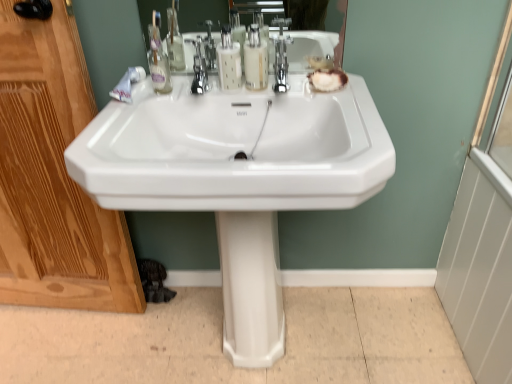
Image resolution: width=512 pixels, height=384 pixels. What do you see at coordinates (229, 61) in the screenshot? I see `translucent plastic soap dispenser at center, marked as the first soap dispenser in a left-to-right arrangement` at bounding box center [229, 61].

The height and width of the screenshot is (384, 512). Describe the element at coordinates (281, 55) in the screenshot. I see `polished chrome faucet at center` at that location.

What do you see at coordinates (255, 59) in the screenshot?
I see `translucent plastic soap dispenser at center, acting as the first soap dispenser starting from the right` at bounding box center [255, 59].

Locate an element on the screen. white glossy sink at center is located at coordinates (234, 150).

Considering the relative sizes of translucent plastic soap dispenser at center, marked as the first soap dispenser in a left-to-right arrangement, and white glossy sink at center in the image provided, is translucent plastic soap dispenser at center, marked as the first soap dispenser in a left-to-right arrangement, wider than white glossy sink at center?

No, translucent plastic soap dispenser at center, marked as the first soap dispenser in a left-to-right arrangement, is not wider than white glossy sink at center.

From a real-world perspective, who is located higher, translucent plastic soap dispenser at center, marked as the first soap dispenser in a left-to-right arrangement, or white glossy sink at center?

translucent plastic soap dispenser at center, marked as the first soap dispenser in a left-to-right arrangement, from a real-world perspective.

Considering the relative sizes of translucent plastic soap dispenser at center, which is counted as the second soap dispenser, starting from the right, and white glossy sink at center in the image provided, is translucent plastic soap dispenser at center, which is counted as the second soap dispenser, starting from the right, taller than white glossy sink at center?

No.

How distant is polished chrome faucet at center from white glossy pedestal at center?

A distance of 54.61 centimeters exists between polished chrome faucet at center and white glossy pedestal at center.

Considering the relative positions of polished chrome faucet at center and white glossy pedestal at center in the image provided, is polished chrome faucet at center to the left or to the right of white glossy pedestal at center?

From the image, it's evident that polished chrome faucet at center is to the right of white glossy pedestal at center.

From a real-world perspective, is polished chrome faucet at center located beneath white glossy pedestal at center?

No, from a real-world perspective, polished chrome faucet at center is not beneath white glossy pedestal at center.

Considering the positions of objects polished chrome faucet at center and white glossy pedestal at center in the image provided, who is in front, polished chrome faucet at center or white glossy pedestal at center?

polished chrome faucet at center is in front.

How far apart are wooden screen door at left and translucent plastic soap dispenser at center, marked as the first soap dispenser in a left-to-right arrangement?

wooden screen door at left and translucent plastic soap dispenser at center, marked as the first soap dispenser in a left-to-right arrangement, are 25.04 inches apart.

Is wooden screen door at left to the left of translucent plastic soap dispenser at center, which is counted as the second soap dispenser, starting from the right, from the viewer's perspective?

Indeed, wooden screen door at left is positioned on the left side of translucent plastic soap dispenser at center, which is counted as the second soap dispenser, starting from the right.

Is wooden screen door at left touching translucent plastic soap dispenser at center, which is counted as the second soap dispenser, starting from the right?

No, wooden screen door at left is not making contact with translucent plastic soap dispenser at center, which is counted as the second soap dispenser, starting from the right.

From the image's perspective, between wooden screen door at left and translucent plastic soap dispenser at center, which is counted as the second soap dispenser, starting from the right, who is located below?

wooden screen door at left is shown below in the image.

Find the location of `the 2nd soap dispenser directly above the polished chrome faucet at center (from a real-world perspective)`. the 2nd soap dispenser directly above the polished chrome faucet at center (from a real-world perspective) is located at coordinates (255, 59).

Could translucent plastic soap dispenser at center, acting as the first soap dispenser starting from the right, be considered to be inside polished chrome faucet at center?

No, translucent plastic soap dispenser at center, acting as the first soap dispenser starting from the right, is not inside polished chrome faucet at center.

From a real-world perspective, is polished chrome faucet at center physically located above or below translucent plastic soap dispenser at center, the 2th soap dispenser positioned from the left?

Clearly, from a real-world perspective, polished chrome faucet at center is below translucent plastic soap dispenser at center, the 2th soap dispenser positioned from the left.

Which of these two, white glossy sink at center or wooden screen door at left, stands taller?

Standing taller between the two is wooden screen door at left.

Looking at their sizes, would you say white glossy sink at center is wider or thinner than wooden screen door at left?

Considering their sizes, white glossy sink at center looks broader than wooden screen door at left.

Is white glossy sink at center positioned with its back to wooden screen door at left?

No.

Considering the positions of point (119, 166) and point (60, 227), is point (119, 166) closer or farther from the camera than point (60, 227)?

Point (119, 166).

In the scene shown: Can you tell me how much white glossy sink at center and translucent plastic soap dispenser at center, marked as the first soap dispenser in a left-to-right arrangement, differ in facing direction?

The facing directions of white glossy sink at center and translucent plastic soap dispenser at center, marked as the first soap dispenser in a left-to-right arrangement, are 2.54 degrees apart.

From the image's perspective, who appears lower, white glossy sink at center or translucent plastic soap dispenser at center, which is counted as the second soap dispenser, starting from the right?

white glossy sink at center is shown below in the image.

Is white glossy sink at center to the left or to the right of translucent plastic soap dispenser at center, marked as the first soap dispenser in a left-to-right arrangement, in the image?

Clearly, white glossy sink at center is on the right of translucent plastic soap dispenser at center, marked as the first soap dispenser in a left-to-right arrangement, in the image.

From a real-world perspective, is white glossy sink at center on translucent plastic soap dispenser at center, which is counted as the second soap dispenser, starting from the right?

Incorrect, from a real-world perspective, white glossy sink at center is lower than translucent plastic soap dispenser at center, which is counted as the second soap dispenser, starting from the right.

From a real-world perspective, relative to wooden screen door at left, is translucent plastic soap dispenser at center, marked as the first soap dispenser in a left-to-right arrangement, vertically above or below?

In terms of real-world spatial position, translucent plastic soap dispenser at center, marked as the first soap dispenser in a left-to-right arrangement, is above wooden screen door at left.

Which is in front, translucent plastic soap dispenser at center, marked as the first soap dispenser in a left-to-right arrangement, or wooden screen door at left?

wooden screen door at left is in front.

Which object is positioned more to the right, translucent plastic soap dispenser at center, which is counted as the second soap dispenser, starting from the right, or wooden screen door at left?

Positioned to the right is translucent plastic soap dispenser at center, which is counted as the second soap dispenser, starting from the right.

This screenshot has width=512, height=384. What are the coordinates of `soap dispenser that is the 1st object located above the white glossy sink at center (from the image's perspective)` in the screenshot? It's located at [x=229, y=61].

At what (x,y) coordinates should I click in order to perform the action: click on tap above the white glossy pedestal at center (from a real-world perspective). Please return your answer as a coordinate pair (x, y). Looking at the image, I should click on (281, 55).

When comparing their distances from translucent plastic soap dispenser at center, the 2th soap dispenser positioned from the left, does white glossy sink at center or translucent plastic soap dispenser at center, which is counted as the second soap dispenser, starting from the right, seem closer?

Based on the image, translucent plastic soap dispenser at center, which is counted as the second soap dispenser, starting from the right, appears to be nearer to translucent plastic soap dispenser at center, the 2th soap dispenser positioned from the left.

Estimate the real-world distances between objects in this image. Which object is further from translucent plastic soap dispenser at center, marked as the first soap dispenser in a left-to-right arrangement, white glossy pedestal at center or polished chrome faucet at center?

The object further to translucent plastic soap dispenser at center, marked as the first soap dispenser in a left-to-right arrangement, is white glossy pedestal at center.

From the image, which object appears to be farther from polished chrome faucet at center, translucent plastic soap dispenser at center, marked as the first soap dispenser in a left-to-right arrangement, or wooden screen door at left?

wooden screen door at left lies further to polished chrome faucet at center than the other object.

When comparing their distances from white glossy pedestal at center, does translucent plastic soap dispenser at center, acting as the first soap dispenser starting from the right, or wooden screen door at left seem closer?

wooden screen door at left.

Based on their spatial positions, is wooden screen door at left or white glossy sink at center closer to polished chrome faucet at center?

white glossy sink at center is closer to polished chrome faucet at center.

Which object lies nearer to the anchor point wooden screen door at left, translucent plastic soap dispenser at center, marked as the first soap dispenser in a left-to-right arrangement, or translucent plastic soap dispenser at center, the 2th soap dispenser positioned from the left?

The object closer to wooden screen door at left is translucent plastic soap dispenser at center, marked as the first soap dispenser in a left-to-right arrangement.

Looking at the image, which one is located closer to translucent plastic soap dispenser at center, the 2th soap dispenser positioned from the left, polished chrome faucet at center or wooden screen door at left?

The object closer to translucent plastic soap dispenser at center, the 2th soap dispenser positioned from the left, is polished chrome faucet at center.

Which object lies further to the anchor point white glossy pedestal at center, translucent plastic soap dispenser at center, which is counted as the second soap dispenser, starting from the right, or polished chrome faucet at center?

Based on the image, polished chrome faucet at center appears to be further to white glossy pedestal at center.

At what (x,y) coordinates should I click in order to perform the action: click on sink between wooden screen door at left and translucent plastic soap dispenser at center, acting as the first soap dispenser starting from the right, from left to right. Please return your answer as a coordinate pair (x, y). The image size is (512, 384). Looking at the image, I should click on (234, 150).

At what (x,y) coordinates should I click in order to perform the action: click on soap dispenser located between wooden screen door at left and translucent plastic soap dispenser at center, acting as the first soap dispenser starting from the right, in the left-right direction. Please return your answer as a coordinate pair (x, y). This screenshot has height=384, width=512. Looking at the image, I should click on (229, 61).

Identify the location of soap dispenser between wooden screen door at left and white glossy sink at center in the horizontal direction. (229, 61).

Where is `bidet between wooden screen door at left and polished chrome faucet at center`? bidet between wooden screen door at left and polished chrome faucet at center is located at coordinates (251, 288).